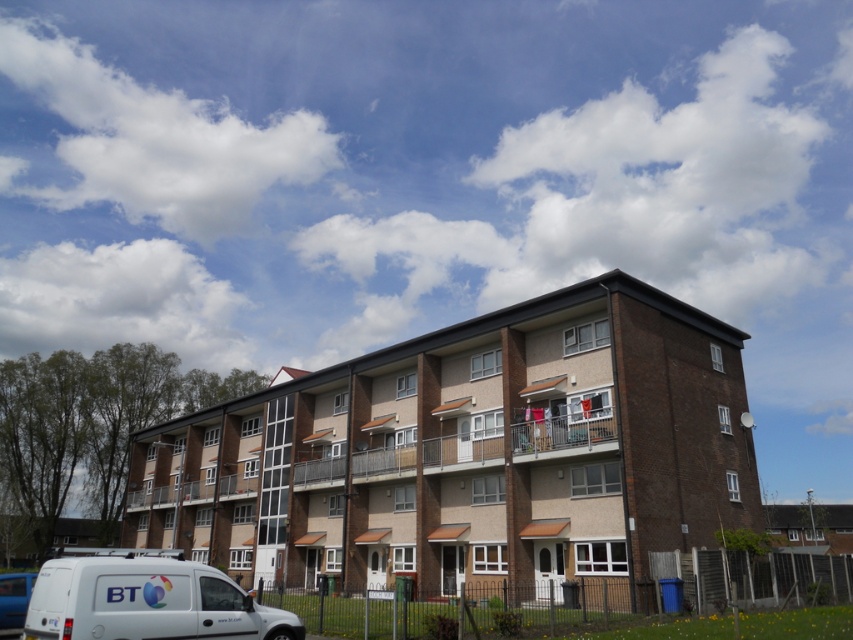
You are a delivery driver who needs to park your 3.5 meter long van between the white matte van at lower left and the blue metallic van at lower left. Is there enough space between them to park your van?

The distance between the white matte van at lower left and the blue metallic van at lower left is 5.76 meters. Since your van is 3.5 meters long, there is sufficient space to park between them as 5.76 meters is greater than 3.5 meters.

You are a delivery driver trying to park your vehicle in the parking lot near the residential building. You see a white matte van at lower left and a blue metallic van at lower left. Which van is blocking the entrance to the parking lot?

The white matte van at lower left is blocking the entrance to the parking lot because it is in front of the blue metallic van at lower left, meaning it is closer to the entrance.

You are a delivery driver who needs to park your van between the white matte van at lower left and the blue metallic van at lower left. Is there enough space between them for your van?

The white matte van at lower left is positioned on the left side of the blue metallic van at lower left, so there is no space between them for another van to park.